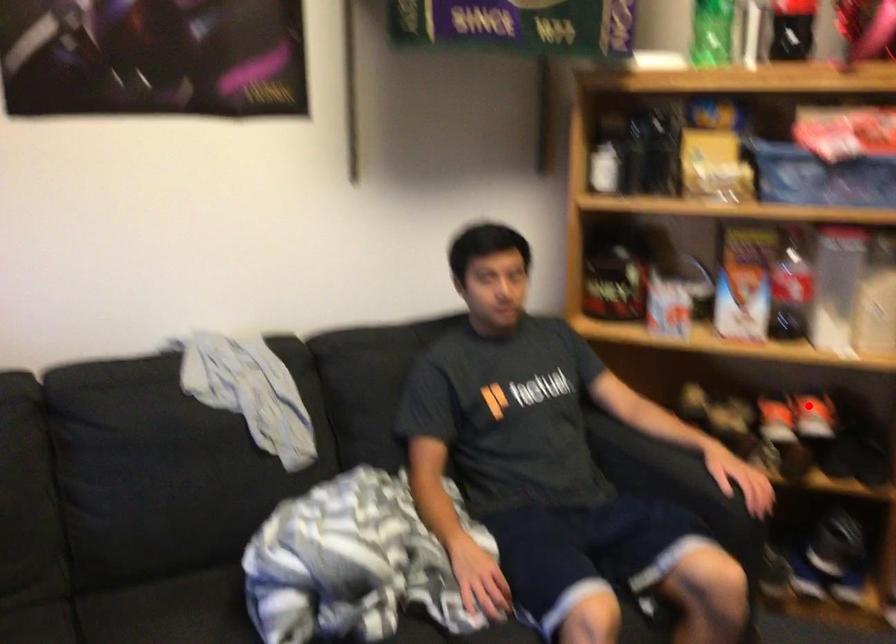
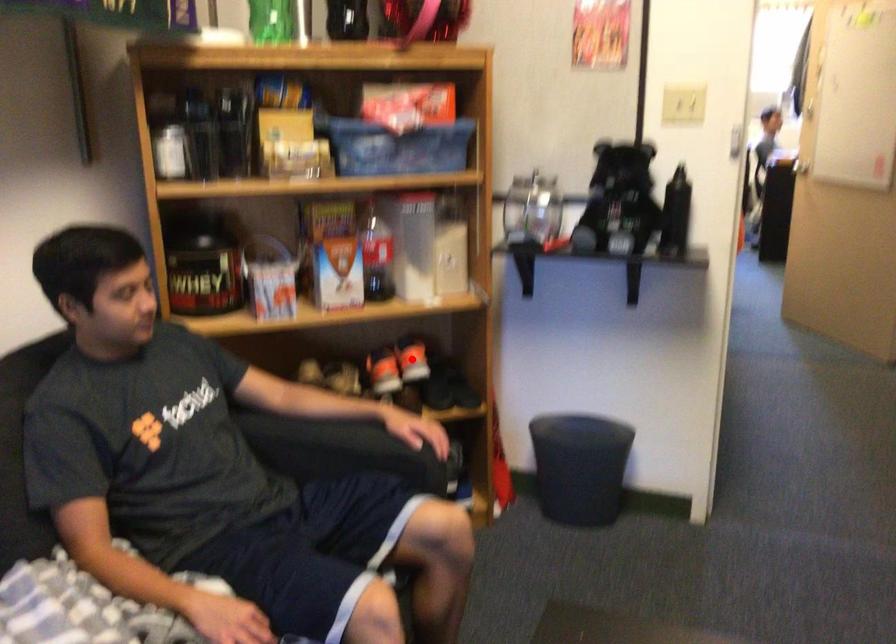
I am providing you with two images of the same scene from different viewpoints. A red point is marked on the first image and another point is marked on the second image. Is the marked point in image1 the same physical position as the marked point in image2?

Yes